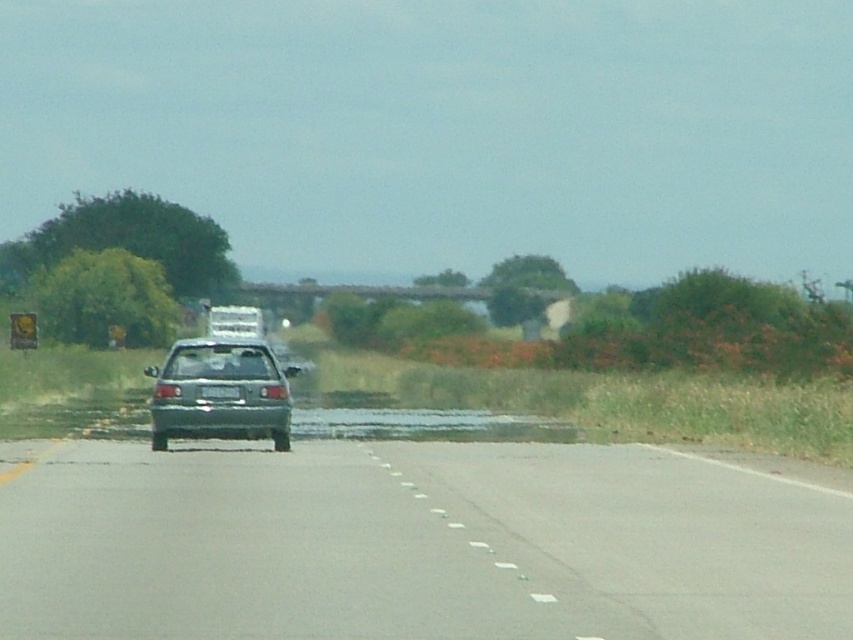
You are a driver approaching the gray asphalt highway at center and gray asphalt flood at center. Which one is narrower?

The gray asphalt highway at center is narrower than the gray asphalt flood at center.

You are a driver approaching the metallic gray hatchback at center and the white plastic license plate at center on the road. Which object is higher in elevation?

The metallic gray hatchback at center is taller than the white plastic license plate at center, so the metallic gray hatchback at center is higher in elevation.